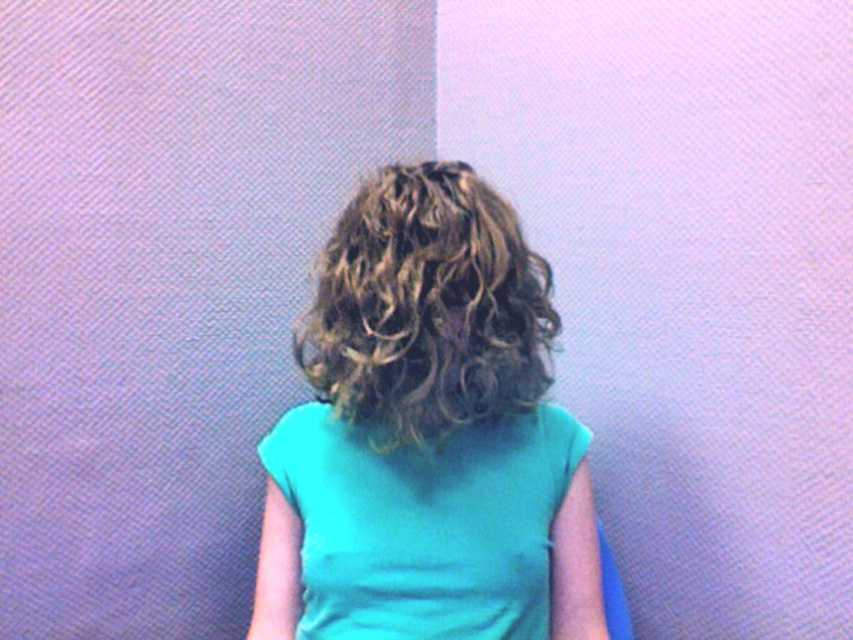
Question: Can you confirm if matte teal shirt at center is thinner than curly blonde hair at center?

Choices:
 (A) no
 (B) yes

Answer: (A)

Question: From the image, what is the correct spatial relationship of teal fabric girl at center in relation to matte teal shirt at center?

Choices:
 (A) below
 (B) above

Answer: (B)

Question: Is matte teal shirt at center positioned at the back of curly blonde hair at center?

Choices:
 (A) yes
 (B) no

Answer: (A)

Question: Which of the following is the farthest from the observer?

Choices:
 (A) (416, 193)
 (B) (492, 525)

Answer: (B)

Question: Estimate the real-world distances between objects in this image. Which object is closer to the teal fabric girl at center?

Choices:
 (A) curly blonde hair at center
 (B) matte teal shirt at center

Answer: (A)

Question: Which point is farther to the camera?

Choices:
 (A) curly blonde hair at center
 (B) matte teal shirt at center
 (C) teal fabric girl at center

Answer: (B)